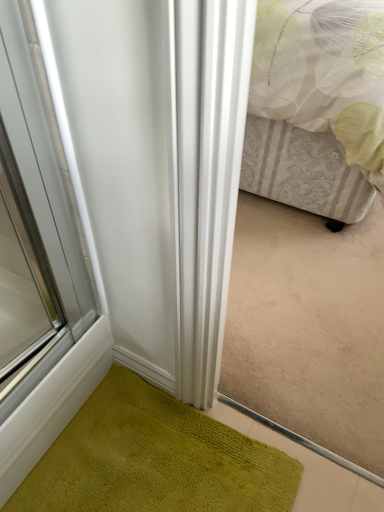
Locate an element on the screen. The image size is (384, 512). free space above green textured bath mat at lower left (from a real-world perspective) is located at coordinates (163, 461).